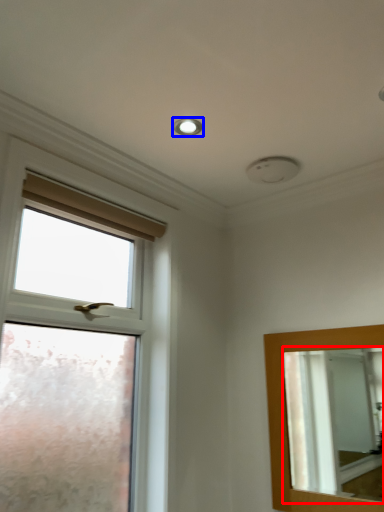
Question: Which object appears farthest to the camera in this image, mirror (highlighted by a red box) or droplight (highlighted by a blue box)?

Choices:
 (A) mirror
 (B) droplight

Answer: (B)